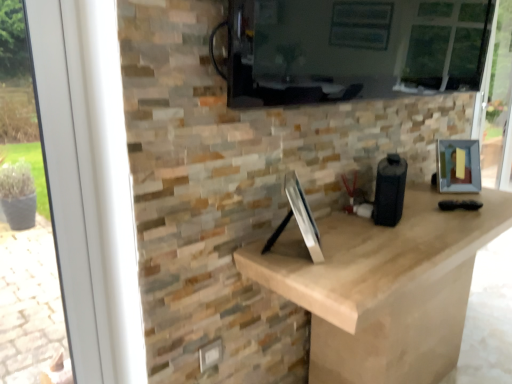
Question: From the image's perspective, is white plastic window frame at left over matte black screen at upper center?

Choices:
 (A) no
 (B) yes

Answer: (A)

Question: Does white plastic window frame at left touch matte black screen at upper center?

Choices:
 (A) yes
 (B) no

Answer: (B)

Question: From a real-world perspective, is white plastic window frame at left below matte black screen at upper center?

Choices:
 (A) yes
 (B) no

Answer: (A)

Question: Considering the relative sizes of white plastic window frame at left and matte black screen at upper center in the image provided, is white plastic window frame at left taller than matte black screen at upper center?

Choices:
 (A) yes
 (B) no

Answer: (A)

Question: Considering the relative positions of white plastic window frame at left and matte black screen at upper center in the image provided, is white plastic window frame at left to the left of matte black screen at upper center from the viewer's perspective?

Choices:
 (A) no
 (B) yes

Answer: (B)

Question: Could you tell me if white plastic window frame at left is facing matte black screen at upper center?

Choices:
 (A) no
 (B) yes

Answer: (A)

Question: From a real-world perspective, is matte black screen at upper center on metallic silver picture frame at right?

Choices:
 (A) yes
 (B) no

Answer: (A)

Question: Is matte black screen at upper center thinner than metallic silver picture frame at right?

Choices:
 (A) no
 (B) yes

Answer: (B)

Question: Is matte black screen at upper center at the right side of metallic silver picture frame at right?

Choices:
 (A) no
 (B) yes

Answer: (A)

Question: From the image's perspective, is matte black screen at upper center located above metallic silver picture frame at right?

Choices:
 (A) yes
 (B) no

Answer: (A)

Question: Is matte black screen at upper center facing towards metallic silver picture frame at right?

Choices:
 (A) yes
 (B) no

Answer: (B)

Question: Is matte black screen at upper center smaller than metallic silver picture frame at right?

Choices:
 (A) yes
 (B) no

Answer: (B)

Question: Is metallic silver picture frame at right wider than matte black screen at upper center?

Choices:
 (A) yes
 (B) no

Answer: (A)